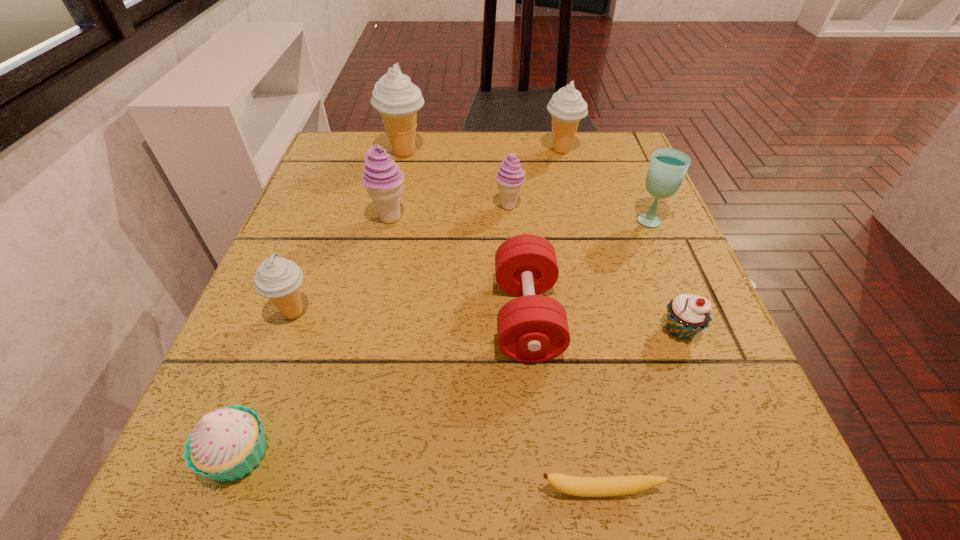
Identify the location of beige icecream that stands as the closest to the rightmost icecream. This screenshot has height=540, width=960. (395, 97).

Where is `beige icecream identified as the second closest to the shortest object`? This screenshot has height=540, width=960. beige icecream identified as the second closest to the shortest object is located at coordinates (567, 107).

At what (x,y) coordinates should I click in order to perform the action: click on vacant space that satisfies the following two spatial constraints: 1. on the back side of the nearest beige icecream; 2. on the right side of the tallest icecream. Please return your answer as a coordinate pair (x, y). Looking at the image, I should click on (354, 153).

What are the coordinates of `vacant space that satisfies the following two spatial constraints: 1. on the back side of the glass; 2. on the right side of the dumbbell` in the screenshot? It's located at (517, 219).

Locate an element on the screen. free region that satisfies the following two spatial constraints: 1. on the front side of the rightmost beige icecream; 2. on the right side of the right cupcake is located at coordinates [606, 330].

Image resolution: width=960 pixels, height=540 pixels. Identify the location of vacant position in the image that satisfies the following two spatial constraints: 1. on the back side of the nearer cupcake; 2. on the right side of the dumbbell. (290, 317).

Find the location of `free space that satisfies the following two spatial constraints: 1. on the back side of the rightmost beige icecream; 2. on the left side of the dumbbell`. free space that satisfies the following two spatial constraints: 1. on the back side of the rightmost beige icecream; 2. on the left side of the dumbbell is located at coordinates (511, 150).